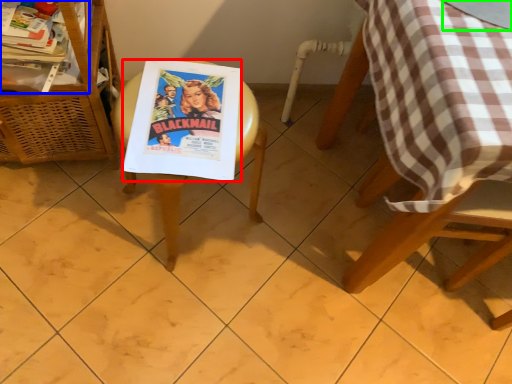
Question: Considering the real-world distances, which object is farthest from comic book (highlighted by a red box)? magazine (highlighted by a blue box) or glass table (highlighted by a green box)?

Choices:
 (A) magazine
 (B) glass table

Answer: (B)